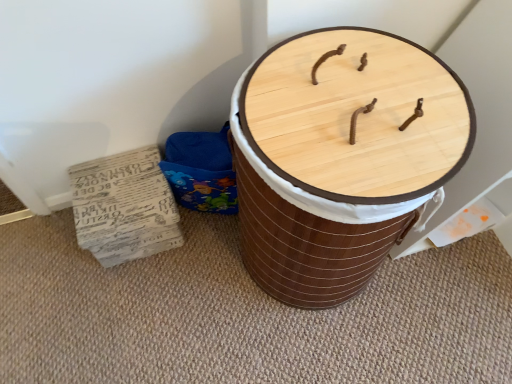
Identify the location of vacant area that lies in front of wooden barrel at center. (334, 348).